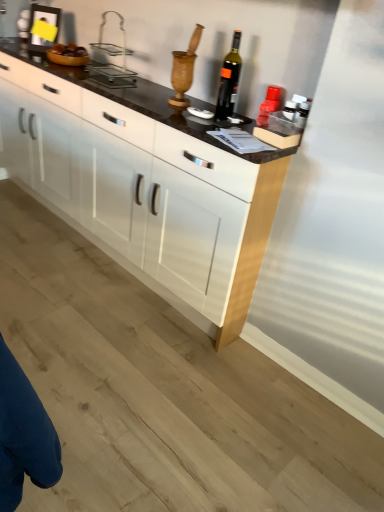
Question: Would you say white glossy cabinet at center is to the left or to the right of dark glass bottle at center in the picture?

Choices:
 (A) left
 (B) right

Answer: (A)

Question: Is white glossy cabinet at center taller or shorter than dark glass bottle at center?

Choices:
 (A) tall
 (B) short

Answer: (A)

Question: Which object is positioned closest to the dark glass bottle at center?

Choices:
 (A) white glossy cabinet at center
 (B) clear plastic basket at upper center

Answer: (B)

Question: Estimate the real-world distances between objects in this image. Which object is farther from the white glossy cabinet at center?

Choices:
 (A) clear plastic basket at upper center
 (B) dark glass bottle at center

Answer: (B)